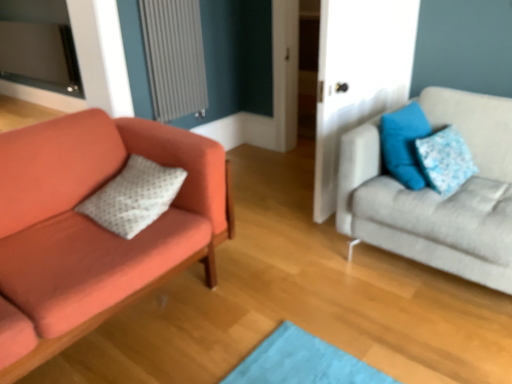
Question: From a real-world perspective, is blue fabric pillow at upper right, positioned as the first pillow in right-to-left order, physically located above or below matte orange couch at left, which is the first studio couch in left-to-right order?

Choices:
 (A) above
 (B) below

Answer: (A)

Question: Is blue fabric pillow at upper right, positioned as the first pillow in right-to-left order, inside or outside of matte orange couch at left, the second studio couch from the right?

Choices:
 (A) inside
 (B) outside

Answer: (B)

Question: Considering the real-world distances, which object is farthest from the gray textured radiator at upper left?

Choices:
 (A) blue fabric pillow at upper right, which ranks as the third pillow in left-to-right order
 (B) blue fabric pillow at upper right, placed as the 2th pillow when sorted from left to right
 (C) white dotted pillow at left, the first pillow viewed from the left
 (D) matte orange couch at left, which is the first studio couch in left-to-right order
 (E) light gray fabric couch at right, which is counted as the second studio couch, starting from the left

Answer: (A)

Question: Estimate the real-world distances between objects in this image. Which object is closer to the white dotted pillow at left, the first pillow viewed from the left?

Choices:
 (A) light gray fabric couch at right, which ranks as the 1th studio couch in right-to-left order
 (B) blue fabric pillow at upper right, positioned as the first pillow in right-to-left order
 (C) matte orange couch at left, which is the first studio couch in left-to-right order
 (D) blue fabric pillow at upper right, placed as the 2th pillow when sorted from left to right
 (E) gray textured radiator at upper left

Answer: (C)